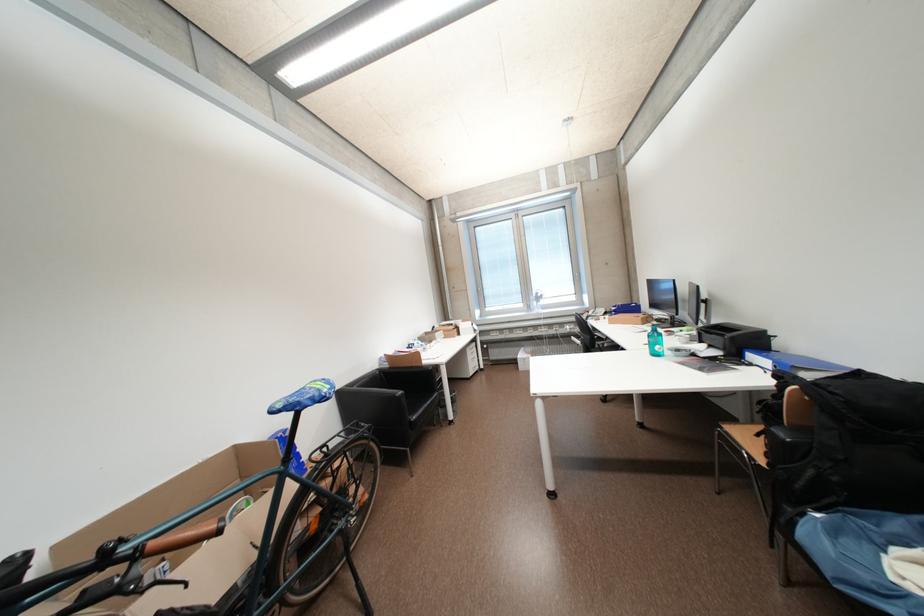
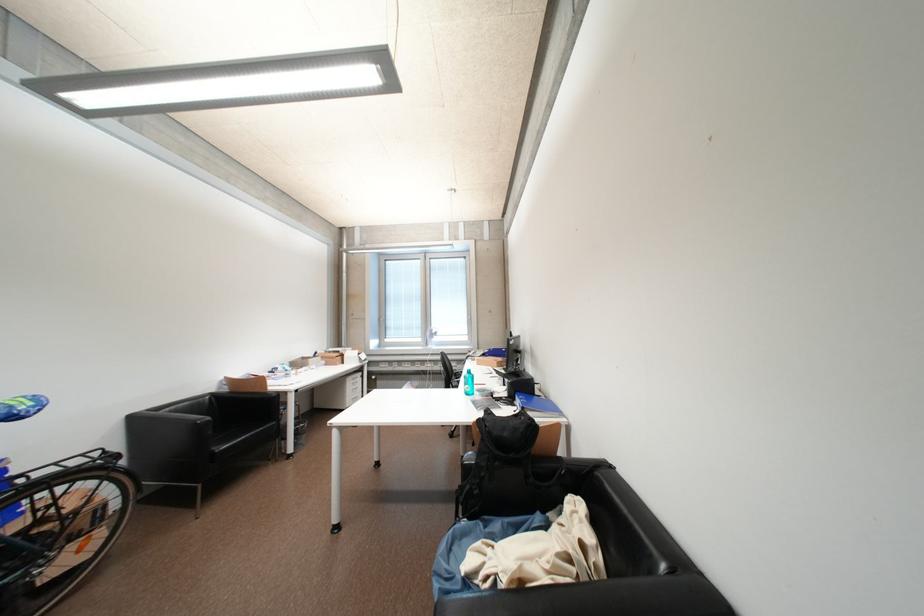
The point at (841, 395) is marked in the first image. Where is the corresponding point in the second image?

(493, 428)